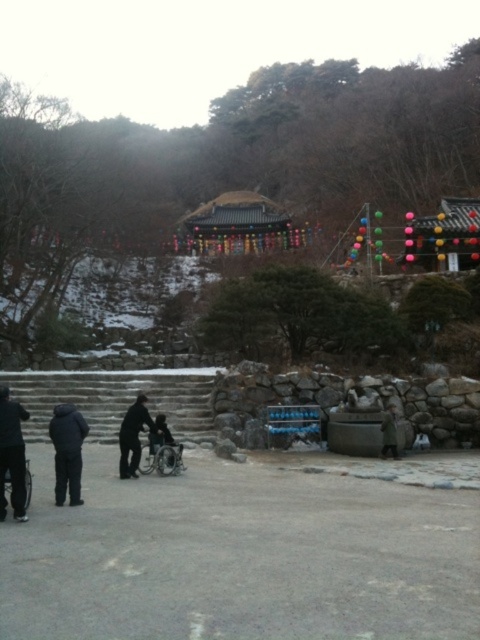
You are a visitor at the temple and want to sit down. You see a green woolen coat at lower right and a silver metallic wheelchair at lower left. Which object takes up more space horizontally?

The silver metallic wheelchair at lower left takes up more space horizontally because its width is greater than the green woolen coat at lower right.

You are standing at the point marked as point (12,454) in the image. What object is located exactly at this point?

The dark gray pants at lower left is located exactly at point (12,454).

You are standing at the entrance of the temple and want to take a photo that includes both the point at coordinates point (14, 440) and point (152, 436). Which point should you focus on to ensure both are in clear view?

You should focus on point (14, 440) because it is closer to the camera than point (152, 436), so focusing on the closer point will keep both in focus.